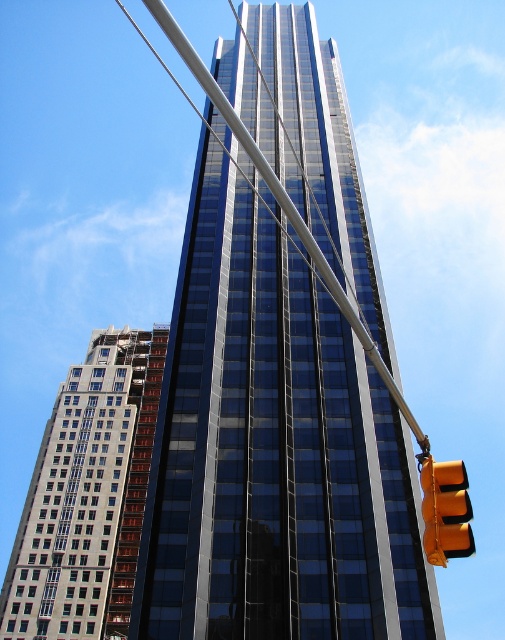
Question: Is glossy glass skyscraper at center closer to the viewer compared to gray concrete building at left?

Choices:
 (A) no
 (B) yes

Answer: (B)

Question: Which object is the farthest from the glossy glass skyscraper at center?

Choices:
 (A) yellow matte traffic light at lower right
 (B) gray concrete building at left

Answer: (A)

Question: Can you confirm if gray concrete building at left is wider than yellow matte traffic light at lower right?

Choices:
 (A) yes
 (B) no

Answer: (A)

Question: Which object is farther from the camera taking this photo?

Choices:
 (A) glossy glass skyscraper at center
 (B) gray concrete building at left
 (C) yellow matte traffic light at lower right

Answer: (B)

Question: Can you confirm if gray concrete building at left is wider than yellow matte traffic light at lower right?

Choices:
 (A) no
 (B) yes

Answer: (B)

Question: Which point appears farthest from the camera in this image?

Choices:
 (A) (365, 611)
 (B) (160, 323)
 (C) (426, 508)

Answer: (B)